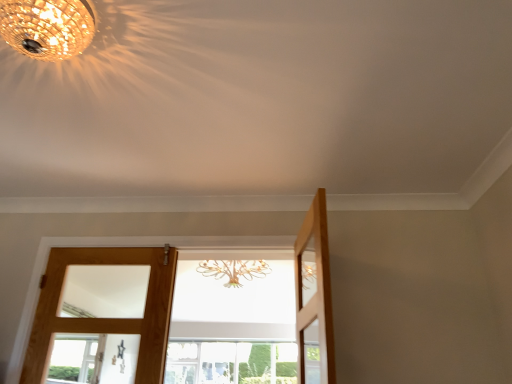
Question: Should I look upward or downward to see clear glass window at center?

Choices:
 (A) up
 (B) down

Answer: (B)

Question: From the image's perspective, is wooden door at center, acting as the second door starting from the right, located beneath light brown wooden door at left, which appears as the first door when viewed from the left?

Choices:
 (A) yes
 (B) no

Answer: (B)

Question: Can you confirm if wooden door at center, the second door in the left-to-right sequence, is thinner than light brown wooden door at left, the third door when ordered from right to left?

Choices:
 (A) yes
 (B) no

Answer: (B)

Question: Is wooden door at center, the second door in the left-to-right sequence, wider than light brown wooden door at left, which appears as the first door when viewed from the left?

Choices:
 (A) yes
 (B) no

Answer: (A)

Question: Is wooden door at center, the second door in the left-to-right sequence, placed right next to light brown wooden door at left, the third door when ordered from right to left?

Choices:
 (A) no
 (B) yes

Answer: (B)

Question: Is wooden door at center, the second door in the left-to-right sequence, turned away from light brown wooden door at left, the third door when ordered from right to left?

Choices:
 (A) no
 (B) yes

Answer: (B)

Question: Does wooden door at center, the second door in the left-to-right sequence, have a lesser height compared to light brown wooden door at left, which appears as the first door when viewed from the left?

Choices:
 (A) no
 (B) yes

Answer: (A)

Question: Does light brown wooden door at right, positioned as the 3th door in left-to-right order, have a greater width compared to clear glass window at center?

Choices:
 (A) yes
 (B) no

Answer: (B)

Question: Considering the relative sizes of light brown wooden door at right, positioned as the 3th door in left-to-right order, and clear glass window at center in the image provided, is light brown wooden door at right, positioned as the 3th door in left-to-right order, thinner than clear glass window at center?

Choices:
 (A) yes
 (B) no

Answer: (A)

Question: Is light brown wooden door at right, positioned as the 3th door in left-to-right order, facing towards clear glass window at center?

Choices:
 (A) no
 (B) yes

Answer: (A)

Question: Is light brown wooden door at right, the 1th door when ordered from right to left, beside clear glass window at center?

Choices:
 (A) yes
 (B) no

Answer: (B)

Question: Is light brown wooden door at right, positioned as the 3th door in left-to-right order, shorter than clear glass window at center?

Choices:
 (A) no
 (B) yes

Answer: (A)

Question: From a real-world perspective, is light brown wooden door at right, the 1th door when ordered from right to left, beneath clear glass window at center?

Choices:
 (A) yes
 (B) no

Answer: (A)

Question: Would you say crystal chandelier at upper left is a long distance from light brown wooden door at left, which appears as the first door when viewed from the left?

Choices:
 (A) yes
 (B) no

Answer: (A)